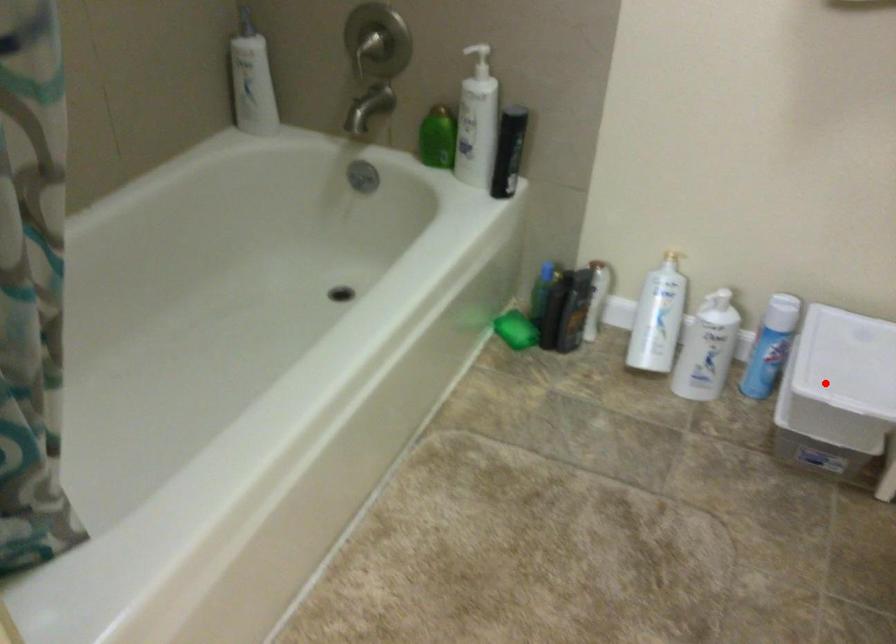
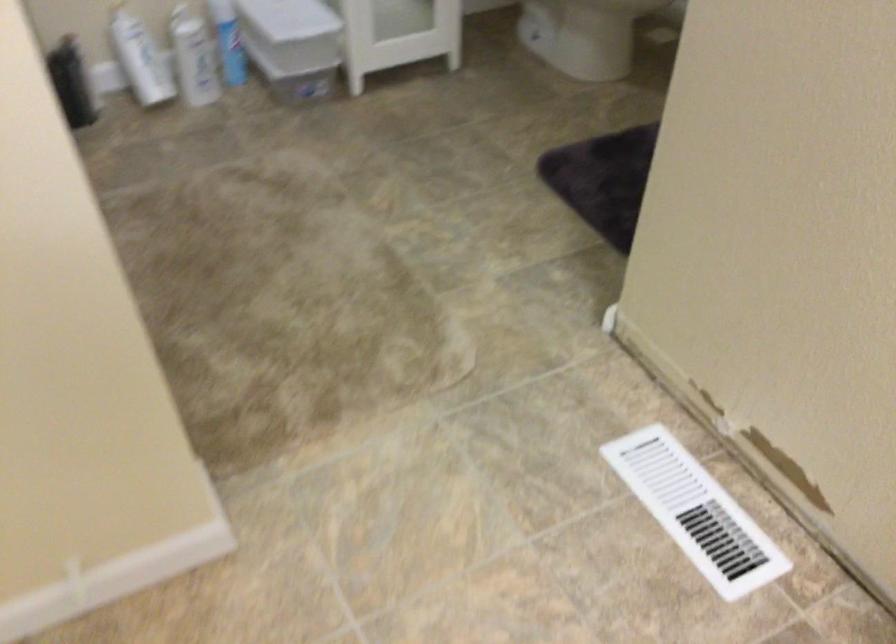
Locate, in the second image, the point that corresponds to the highlighted location in the first image.

(293, 32)